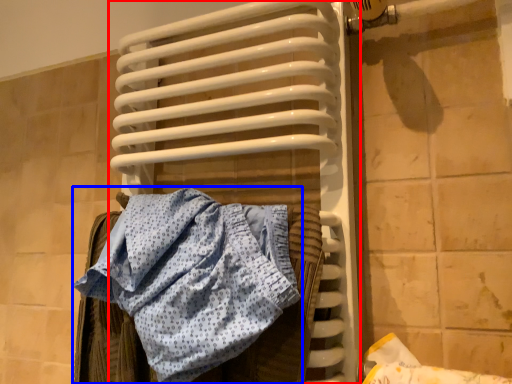
Question: Which object appears farthest to the camera in this image, radiator (highlighted by a red box) or towel (highlighted by a blue box)?

Choices:
 (A) radiator
 (B) towel

Answer: (A)